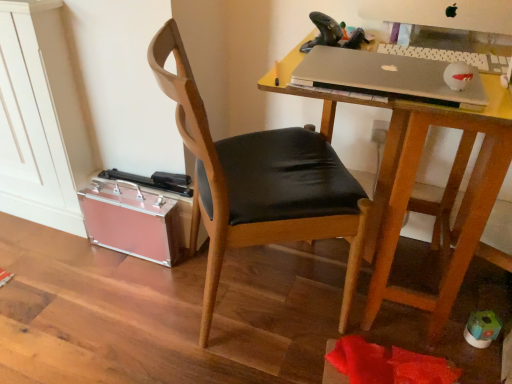
Identify the location of vacant location below wooden chair at center (from a real-world perspective). This screenshot has height=384, width=512. pyautogui.click(x=243, y=293).